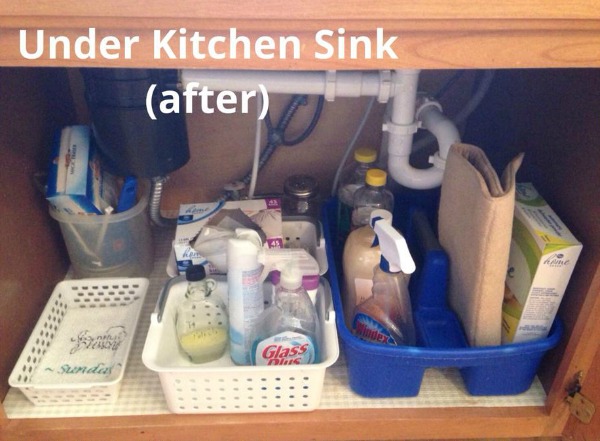
Where is `household supply box`? household supply box is located at coordinates (547, 284), (76, 187).